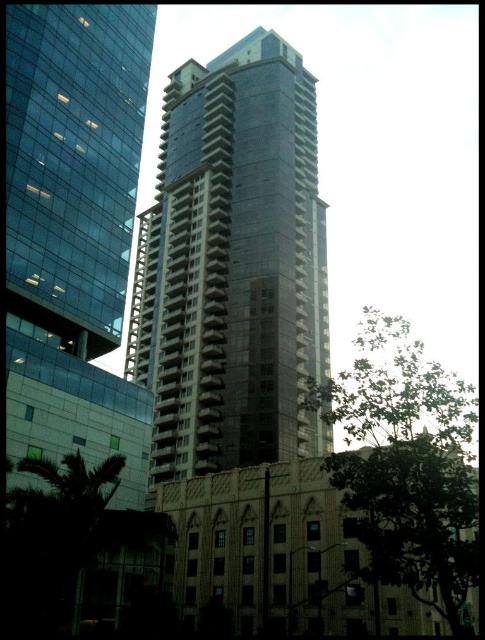
Between smooth glass tower at center and green leafy tree at lower left, which one appears on the right side from the viewer's perspective?

smooth glass tower at center

Is smooth glass tower at center taller than green leafy tree at lower left?

Correct, smooth glass tower at center is much taller as green leafy tree at lower left.

You are a GUI agent. You are given a task and a screenshot of the screen. Output one action in this format:
    pyautogui.click(x=<x>, y=<y>)
    Task: Click on the smooth glass tower at center
    The width and height of the screenshot is (485, 640).
    Given the screenshot: What is the action you would take?
    pyautogui.click(x=232, y=266)

Where is `smooth glass tower at center`? Image resolution: width=485 pixels, height=640 pixels. smooth glass tower at center is located at coordinates (232, 266).

Measure the distance from green leafy tree at center to green leafy tree at lower left.

A distance of 23.01 meters exists between green leafy tree at center and green leafy tree at lower left.

Is green leafy tree at center shorter than green leafy tree at lower left?

No.

Which is behind, point (326, 412) or point (150, 611)?

The point (326, 412) is behind.

The image size is (485, 640). Identify the location of green leafy tree at center. (405, 465).

Identify the location of smooth glass tower at center. coord(232,266).

Is smooth glass tower at center bigger than green leafy tree at center?

Incorrect, smooth glass tower at center is not larger than green leafy tree at center.

Which is in front, point (300, 157) or point (421, 472)?

Point (421, 472)

Where is `smooth glass tower at center`? The image size is (485, 640). smooth glass tower at center is located at coordinates (232, 266).